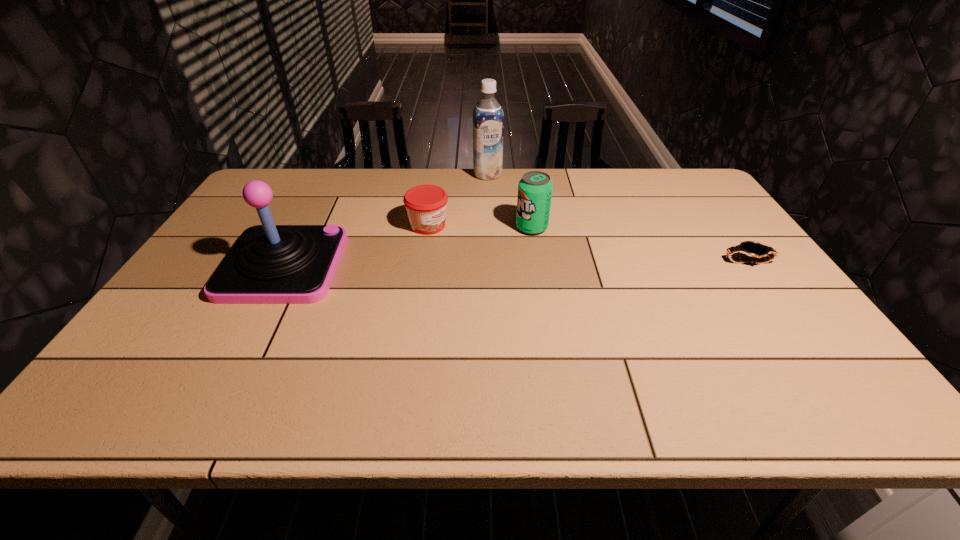
Image resolution: width=960 pixels, height=540 pixels. Find the location of `free spot located forward from the base of the joystick`. free spot located forward from the base of the joystick is located at coordinates (459, 265).

At what (x,y) coordinates should I click in order to perform the action: click on vacant area situated on the left of the shortest object. Please return your answer as a coordinate pair (x, y). The image size is (960, 540). Looking at the image, I should click on (631, 262).

Where is `vacant space located on the front-facing side of the third tallest object`? Image resolution: width=960 pixels, height=540 pixels. vacant space located on the front-facing side of the third tallest object is located at coordinates (501, 241).

Where is `vacant position located on the front-facing side of the third tallest object`? Image resolution: width=960 pixels, height=540 pixels. vacant position located on the front-facing side of the third tallest object is located at coordinates (457, 262).

I want to click on vacant space located 0.080m on the front-facing side of the third tallest object, so click(x=499, y=243).

Locate an element on the screen. free space located on the label of the farthest object is located at coordinates pos(510,239).

Where is `free space located on the label of the farthest object`? Image resolution: width=960 pixels, height=540 pixels. free space located on the label of the farthest object is located at coordinates (505, 226).

I want to click on free location located 0.250m on the label of the farthest object, so click(x=503, y=220).

I want to click on free spot located 0.100m on the label side of the fourth object from right to left, so tap(470, 245).

In order to click on vacant space located on the label side of the fourth object from right to left in this screenshot , I will do `click(493, 255)`.